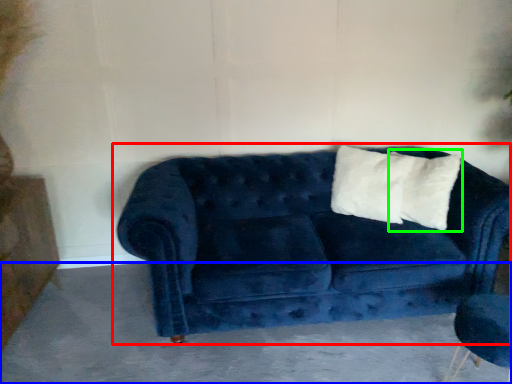
Question: Considering the real-world distances, which object is farthest from studio couch (highlighted by a red box)? concrete (highlighted by a blue box) or pillow (highlighted by a green box)?

Choices:
 (A) concrete
 (B) pillow

Answer: (B)